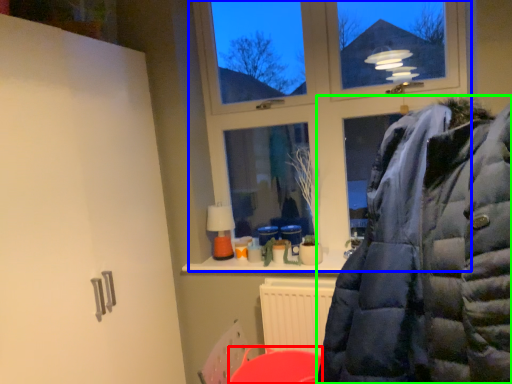
Question: Based on their relative distances, which object is nearer to table (highlighted by a red box)? Choose from window (highlighted by a blue box) and jacket (highlighted by a green box).

Choices:
 (A) window
 (B) jacket

Answer: (A)